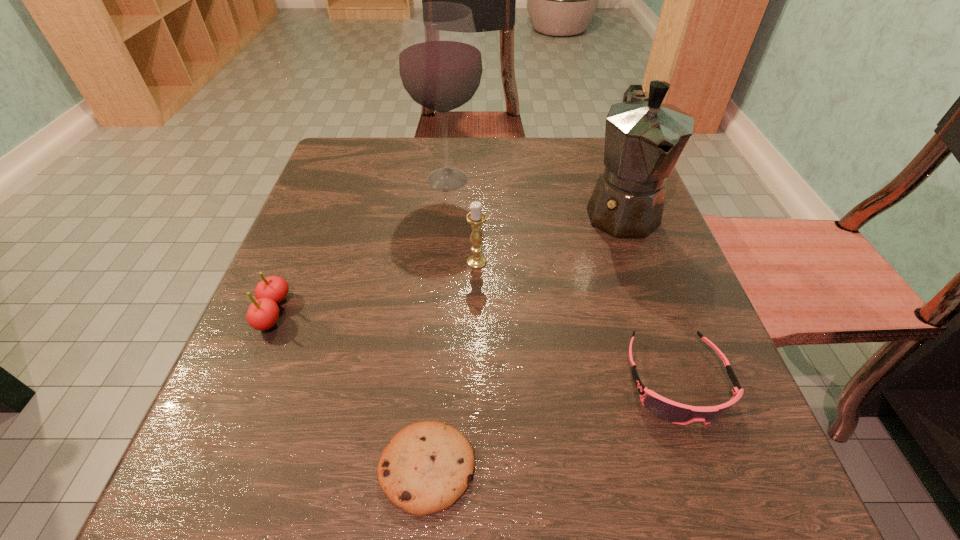
I want to click on free spot that satisfies the following two spatial constraints: 1. on the front side of the tallest object; 2. on the right side of the cookie, so click(421, 468).